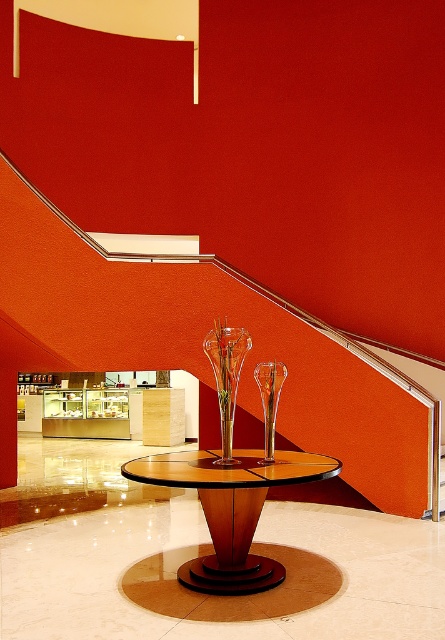
You are standing in the modern interior space described. You need to place a new sculpture exactly at the point marked by the coordinates point (112, 410). What object will the sculpture be placed on?

The point (112, 410) marks the matte glass display case at center, so the sculpture will be placed on the matte glass display case at center.

You are standing in the room and want to place a 3.5 meter long sculpture between yourself and the wooden polished table at center. Is there enough space?

The distance between you and the wooden polished table at center is 3.49 meters. Since the sculpture is 3.5 meters long, there isn not enough space to place it between you and the table.

Looking at this image, you are arranging flowers for an event and need to place a bouquet in the larger container. Which object should you choose between the matte glass display case at center and the transparent glass vase at center?

The matte glass display case at center is bigger than the transparent glass vase at center, so you should choose the matte glass display case at center for the bouquet.